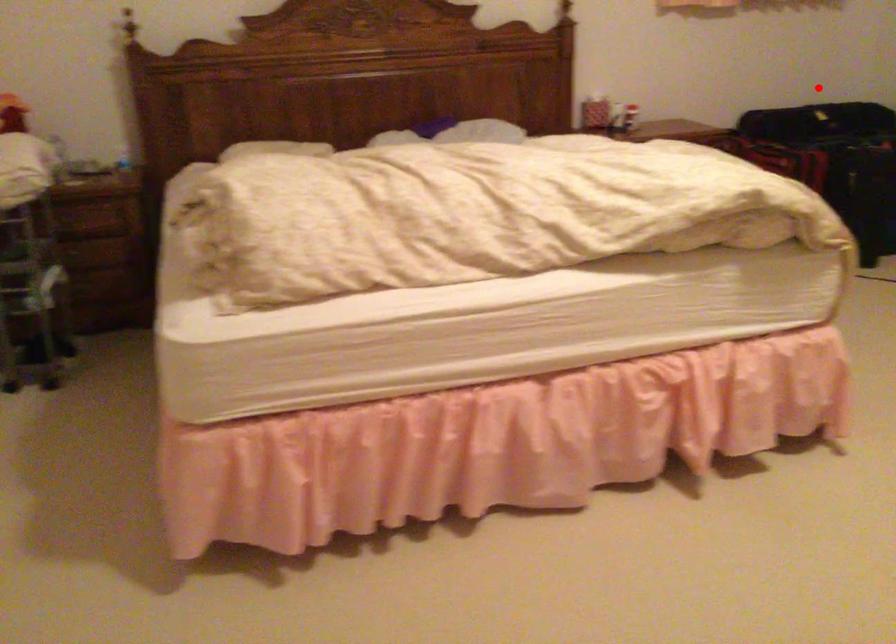
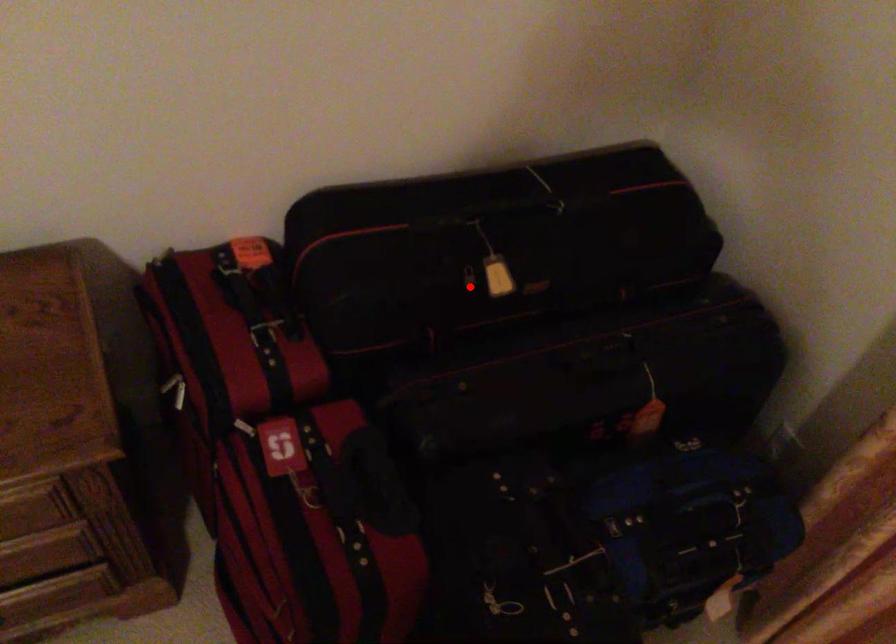
I am providing you with two images of the same scene from different viewpoints. A red point is marked on the first image and another point is marked on the second image. Do the highlighted points in image1 and image2 indicate the same real-world spot?

Yes